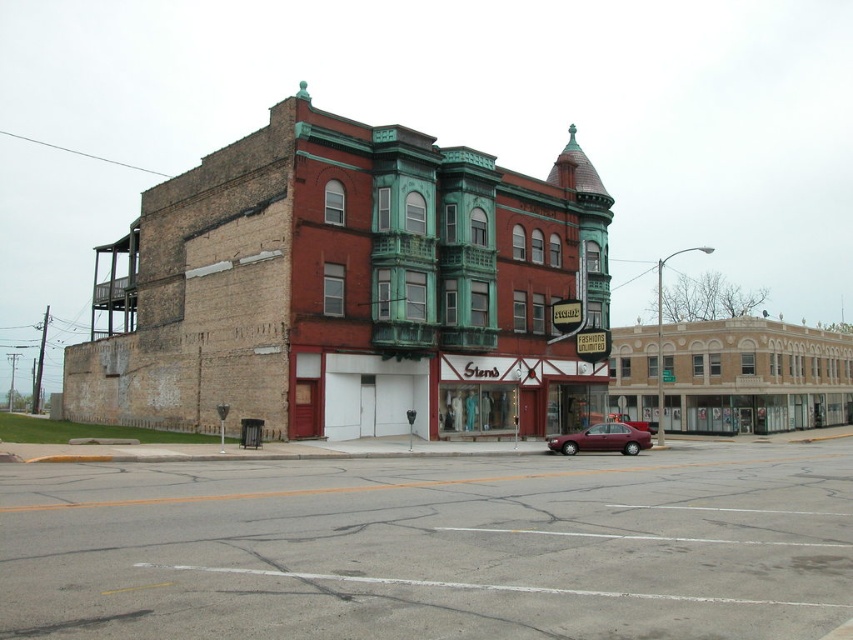
You are driving a car and want to park your maroon metallic sedan at center on the asphalt road at center. Can you safely park your car there?

The asphalt road at center might be wider than the maroon metallic sedan at center, so there is a possibility that the car can fit, but it is uncertain due to the lack of exact measurements.

In the scene shown: You are standing at the street corner looking at the building. There are two points marked on the building wall. The first point is at coordinates point (404, 621) and the second is at point (624, 452). Which point is closer to you?

Point (404, 621) is closer to the viewer than point (624, 452).

You are standing on the sidewalk and want to cross the asphalt road at center to reach the building on the other side. The road is 5.50 meters wide. If your wheelchair has a turning radius of 1.2 meters, can you safely navigate across the road without hitting the curb?

The asphalt road at center is 5.50 meters wide. Since the wheelchair requires a turning radius of 1.2 meters, the total space needed for maneuvering would be at least double the turning radius, so 2.4 meters. Since the road is wider than 2.4 meters, you can safely navigate across the asphalt road at center without hitting the curb.